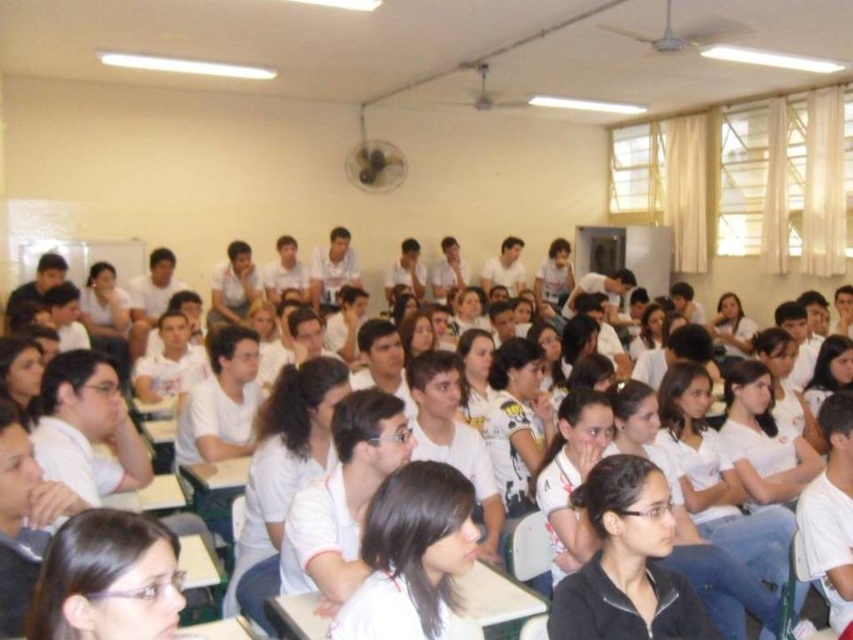
Question: Which object is the farthest from the white matte shirt at center?

Choices:
 (A) matte white shirt at lower left
 (B) black matte jacket at lower center

Answer: (A)

Question: Is white matte shirt at center above matte white shirt at lower left?

Choices:
 (A) yes
 (B) no

Answer: (B)

Question: Which of these objects is positioned farthest from the black matte jacket at lower center?

Choices:
 (A) matte white shirt at lower left
 (B) white matte shirt at center

Answer: (A)

Question: Which point is farther from the camera taking this photo?

Choices:
 (A) (555, 593)
 (B) (163, 576)
 (C) (422, 627)

Answer: (A)

Question: Is white matte shirt at center to the right of matte white shirt at lower left from the viewer's perspective?

Choices:
 (A) yes
 (B) no

Answer: (A)

Question: Can you confirm if black matte jacket at lower center is wider than matte white shirt at lower left?

Choices:
 (A) yes
 (B) no

Answer: (A)